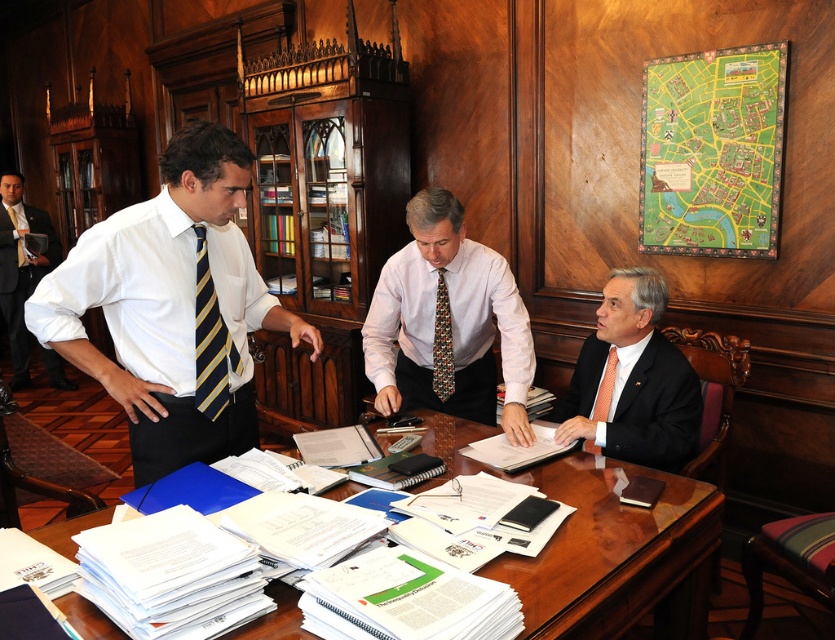
You are a photographer standing in the room and want to take a picture of the white shirt at left and the multicolored woven tie at center. Which object should you focus on first if you want to capture both in the same frame without moving the camera?

You should focus on the white shirt at left first because it is above the multicolored woven tie at center, so adjusting focus from top to bottom will ensure both are in the frame.

You are attending a formal meeting and notice two ties in the scene. Which tie is positioned higher up, the yellow and blue striped tie at left or the orange silk tie at right?

The yellow and blue striped tie at left is positioned higher up than the orange silk tie at right.

You are a tailor observing a meeting scene. You need to determine which tie, the multicolored woven tie at center or the orange silk tie at right, can be altered to fit a standard collar size. Based on their sizes, which one is more likely to require adjustments?

The orange silk tie at right is smaller in size compared to the multicolored woven tie at center, so it might need to be adjusted to fit a standard collar size.